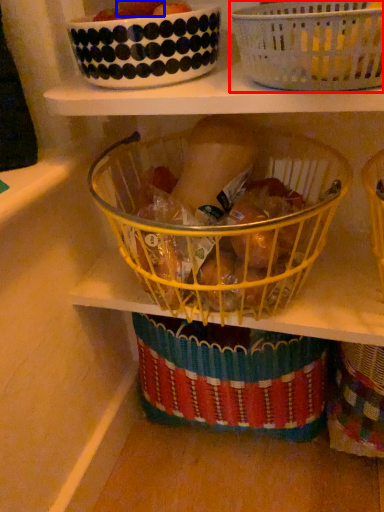
Question: Which object is closer to the camera taking this photo, basket (highlighted by a red box) or fruit (highlighted by a blue box)?

Choices:
 (A) basket
 (B) fruit

Answer: (A)